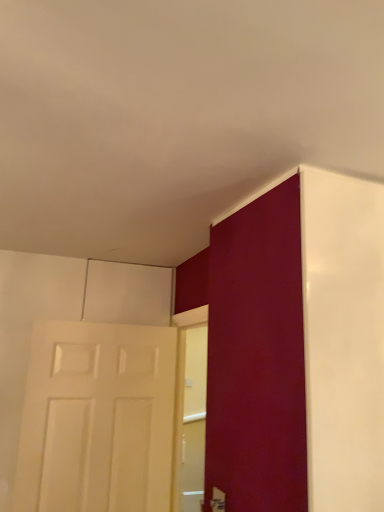
Question: In the image, is white matte door at left, which appears as the second door when viewed from the right, positioned in front of or behind matte white door at right, which is counted as the 1th door, starting from the front?

Choices:
 (A) behind
 (B) front

Answer: (A)

Question: In terms of width, does white matte door at left, which appears as the second door when viewed from the right, look wider or thinner when compared to matte white door at right, the first door viewed from the right?

Choices:
 (A) thin
 (B) wide

Answer: (A)

Question: From a real-world perspective, is white matte door at left, the 2th door positioned from the front, positioned above or below matte white door at right, the first door viewed from the right?

Choices:
 (A) below
 (B) above

Answer: (A)

Question: From a real-world perspective, relative to white matte door at left, which appears as the second door when viewed from the right, is matte white door at right, placed as the 2th door when sorted from back to front, vertically above or below?

Choices:
 (A) above
 (B) below

Answer: (A)

Question: Considering their positions, is matte white door at right, the first door viewed from the right, located in front of or behind white matte door at left, the first door viewed from the left?

Choices:
 (A) behind
 (B) front

Answer: (B)

Question: Is matte white door at right, the second door viewed from the left, situated inside white matte door at left, the 2th door positioned from the front, or outside?

Choices:
 (A) outside
 (B) inside

Answer: (A)

Question: Would you say matte white door at right, placed as the 2th door when sorted from back to front, is to the left or to the right of white matte door at left, the 2th door positioned from the front, in the picture?

Choices:
 (A) left
 (B) right

Answer: (B)